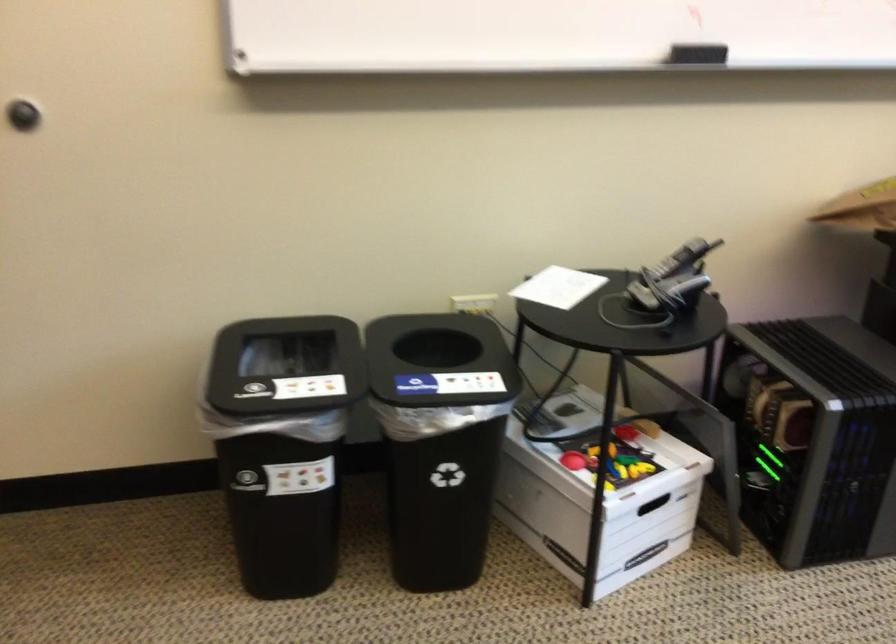
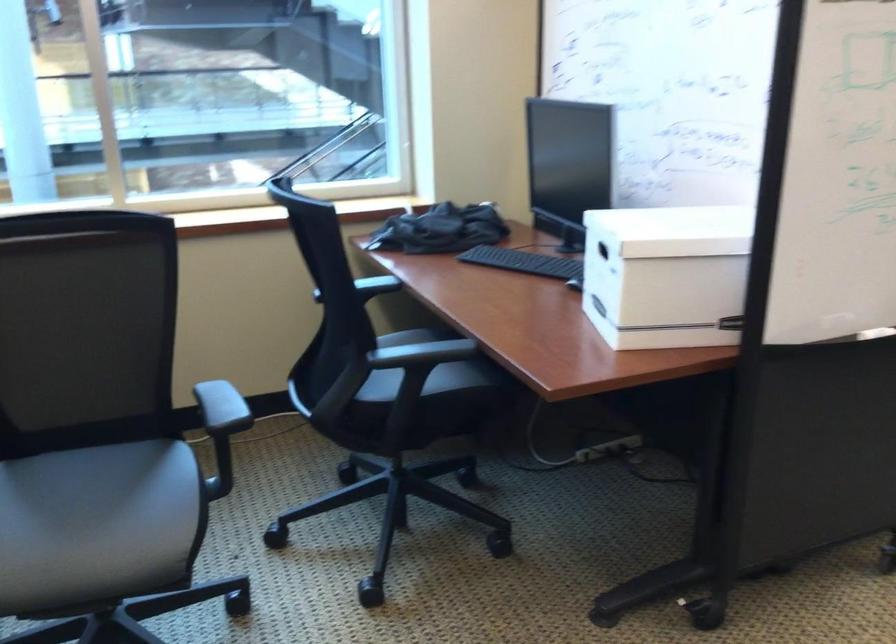
First-person continuous shooting, in which direction is the camera rotating?

The rotation direction of the camera is right-down.